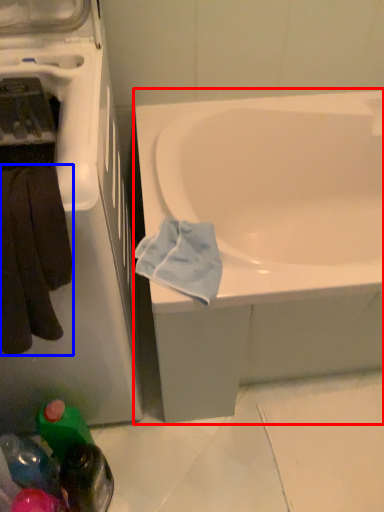
Question: Which of the following is the closest to the observer, bathtub (highlighted by a red box) or towel/napkin (highlighted by a blue box)?

Choices:
 (A) bathtub
 (B) towel/napkin

Answer: (B)